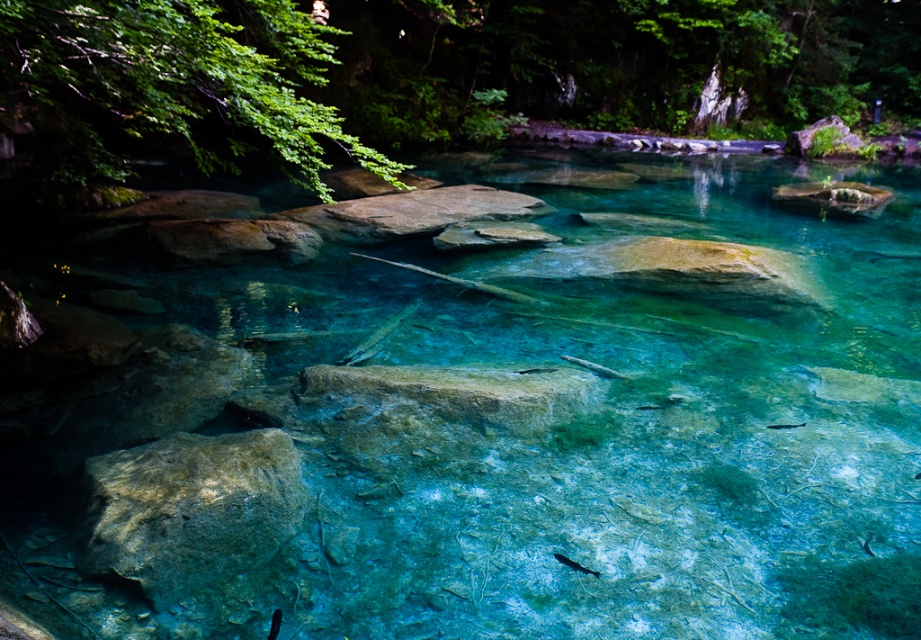
From the picture: Who is shorter, shiny blue fish at center or shiny silver fish at center?

shiny silver fish at center

Is shiny blue fish at center smaller than shiny silver fish at center?

Actually, shiny blue fish at center might be larger than shiny silver fish at center.

Where is `shiny blue fish at center`? The height and width of the screenshot is (640, 921). shiny blue fish at center is located at coordinates (574, 564).

In order to click on shiny blue fish at center in this screenshot , I will do `click(574, 564)`.

Consider the image. Does translucent rock at lower left appear under translucent blue fish at center?

Indeed, translucent rock at lower left is positioned under translucent blue fish at center.

Which is behind, point (194, 547) or point (766, 428)?

The point (766, 428) is more distant.

Which is behind, point (243, 435) or point (775, 428)?

The point (775, 428) is behind.

You are a GUI agent. You are given a task and a screenshot of the screen. Output one action in this format:
    pyautogui.click(x=<x>, y=<y>)
    Task: Click on the translucent rock at lower left
    Image resolution: width=921 pixels, height=640 pixels.
    Given the screenshot: What is the action you would take?
    point(189,509)

This screenshot has height=640, width=921. Identify the location of shiny blue fish at center. (574, 564).

Who is more forward, (561, 563) or (803, 426)?

Point (561, 563)

You are a GUI agent. You are given a task and a screenshot of the screen. Output one action in this format:
    pyautogui.click(x=<x>, y=<y>)
    Task: Click on the shiny blue fish at center
    This screenshot has width=921, height=640.
    Given the screenshot: What is the action you would take?
    pyautogui.click(x=574, y=564)